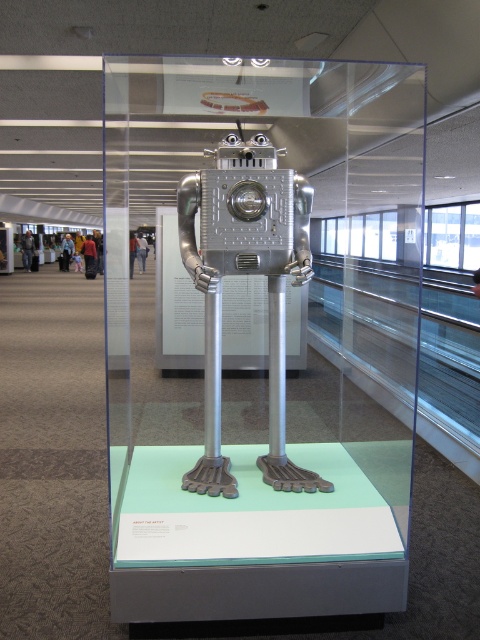
Question: Does transparent glass robot at center appear on the right side of metallic robot at center?

Choices:
 (A) yes
 (B) no

Answer: (B)

Question: In this image, where is transparent glass robot at center located relative to metallic robot at center?

Choices:
 (A) above
 (B) below

Answer: (A)

Question: Which of the following is the closest to the observer?

Choices:
 (A) metallic robot at center
 (B) transparent glass robot at center

Answer: (B)

Question: Can you confirm if transparent glass robot at center is positioned to the left of metallic robot at center?

Choices:
 (A) no
 (B) yes

Answer: (B)

Question: Which object appears farthest from the camera in this image?

Choices:
 (A) transparent glass robot at center
 (B) metallic robot at center

Answer: (B)